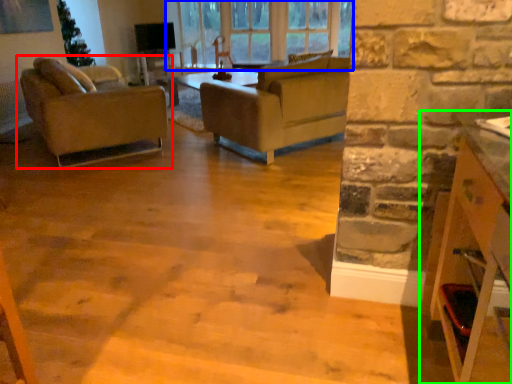
Question: Which object is the closest to the chair (highlighted by a red box)? Choose among these: window (highlighted by a blue box) or cabinetry (highlighted by a green box).

Choices:
 (A) window
 (B) cabinetry

Answer: (A)